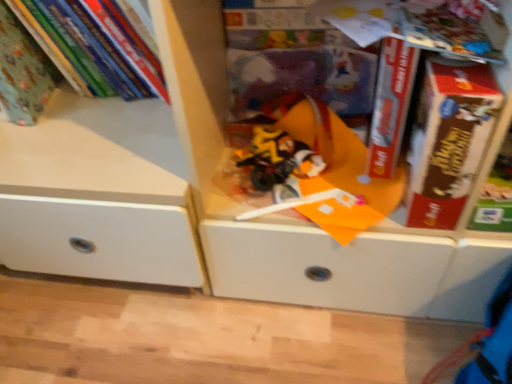
Question: From the image's perspective, is translucent plastic toy at center below matte green book at upper left, which is counted as the second book, starting from the right?

Choices:
 (A) yes
 (B) no

Answer: (A)

Question: Is translucent plastic toy at center looking in the opposite direction of matte green book at upper left, which is counted as the second book, starting from the right?

Choices:
 (A) yes
 (B) no

Answer: (B)

Question: Can you confirm if translucent plastic toy at center is bigger than matte green book at upper left, the first book from the left?

Choices:
 (A) no
 (B) yes

Answer: (A)

Question: Can you see translucent plastic toy at center touching matte green book at upper left, which is counted as the second book, starting from the right?

Choices:
 (A) yes
 (B) no

Answer: (B)

Question: Considering the relative positions of translucent plastic toy at center and matte green book at upper left, the first book from the left, in the image provided, is translucent plastic toy at center behind matte green book at upper left, the first book from the left,?

Choices:
 (A) yes
 (B) no

Answer: (A)

Question: Based on their sizes in the image, would you say matte green book at upper left, which is the 1th book from right to left, is bigger or smaller than red matte book at center, the second paperback book viewed from the right?

Choices:
 (A) big
 (B) small

Answer: (A)

Question: Considering the relative positions of matte green book at upper left, arranged as the 2th book when viewed from the left, and red matte book at center, the 1th paperback book in the left-to-right sequence, in the image provided, is matte green book at upper left, arranged as the 2th book when viewed from the left, to the left or to the right of red matte book at center, the 1th paperback book in the left-to-right sequence,?

Choices:
 (A) right
 (B) left

Answer: (B)

Question: From a real-world perspective, is matte green book at upper left, arranged as the 2th book when viewed from the left, positioned above or below red matte book at center, the 1th paperback book in the left-to-right sequence?

Choices:
 (A) above
 (B) below

Answer: (A)

Question: From the image's perspective, is matte green book at upper left, which is the 1th book from right to left, positioned above or below red matte book at center, the second paperback book viewed from the right?

Choices:
 (A) above
 (B) below

Answer: (A)

Question: Considering the positions of translucent plastic toy at center and brown cardboard book at right, which is the 1th paperback book in right-to-left order, in the image, is translucent plastic toy at center wider or thinner than brown cardboard book at right, which is the 1th paperback book in right-to-left order,?

Choices:
 (A) thin
 (B) wide

Answer: (B)

Question: Considering the relative positions of translucent plastic toy at center and brown cardboard book at right, which is the 1th paperback book in right-to-left order, in the image provided, is translucent plastic toy at center to the left or to the right of brown cardboard book at right, which is the 1th paperback book in right-to-left order,?

Choices:
 (A) right
 (B) left

Answer: (B)

Question: From a real-world perspective, relative to brown cardboard book at right, which is the 1th paperback book in right-to-left order, is translucent plastic toy at center vertically above or below?

Choices:
 (A) above
 (B) below

Answer: (B)

Question: Is translucent plastic toy at center taller or shorter than brown cardboard book at right, placed as the second paperback book when sorted from left to right?

Choices:
 (A) tall
 (B) short

Answer: (B)

Question: Is translucent plastic toy at center in front of or behind matte green book at upper left, arranged as the 2th book when viewed from the left, in the image?

Choices:
 (A) behind
 (B) front

Answer: (B)

Question: Is translucent plastic toy at center wider or thinner than matte green book at upper left, arranged as the 2th book when viewed from the left?

Choices:
 (A) thin
 (B) wide

Answer: (A)